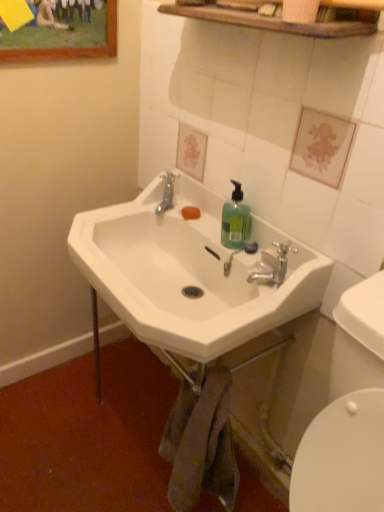
Question: Is the position of translucent green liquid at sink right less distant than that of wooden framed painting at upper left?

Choices:
 (A) yes
 (B) no

Answer: (A)

Question: Can you confirm if translucent green liquid at sink right is positioned to the left of wooden framed painting at upper left?

Choices:
 (A) no
 (B) yes

Answer: (A)

Question: Can we say translucent green liquid at sink right lies outside wooden framed painting at upper left?

Choices:
 (A) no
 (B) yes

Answer: (B)

Question: Is translucent green liquid at sink right shorter than wooden framed painting at upper left?

Choices:
 (A) yes
 (B) no

Answer: (A)

Question: Does translucent green liquid at sink right contain wooden framed painting at upper left?

Choices:
 (A) no
 (B) yes

Answer: (A)

Question: Could you tell me if translucent green liquid at sink right is turned towards wooden framed painting at upper left?

Choices:
 (A) no
 (B) yes

Answer: (A)

Question: Is white ceramic sink at center completely or partially inside silver metallic faucet at upper center, which is the 2th plumbing fixture from front to back?

Choices:
 (A) yes
 (B) no

Answer: (B)

Question: Is silver metallic faucet at upper center, which appears as the second plumbing fixture when ordered from the bottom, behind white ceramic sink at center?

Choices:
 (A) yes
 (B) no

Answer: (A)

Question: From the image's perspective, is silver metallic faucet at upper center, which appears as the second plumbing fixture when ordered from the bottom, located above white ceramic sink at center?

Choices:
 (A) no
 (B) yes

Answer: (B)

Question: Can you confirm if silver metallic faucet at upper center, which appears as the second plumbing fixture when ordered from the bottom, is thinner than white ceramic sink at center?

Choices:
 (A) yes
 (B) no

Answer: (A)

Question: Considering the relative sizes of silver metallic faucet at upper center, the second plumbing fixture when ordered from right to left, and white ceramic sink at center in the image provided, is silver metallic faucet at upper center, the second plumbing fixture when ordered from right to left, bigger than white ceramic sink at center?

Choices:
 (A) no
 (B) yes

Answer: (A)

Question: Can you confirm if silver metallic faucet at upper center, marked as the 1th plumbing fixture in a back-to-front arrangement, is smaller than white ceramic sink at center?

Choices:
 (A) yes
 (B) no

Answer: (A)

Question: From the image's perspective, is translucent green liquid at sink right under white ceramic sink at center?

Choices:
 (A) no
 (B) yes

Answer: (A)